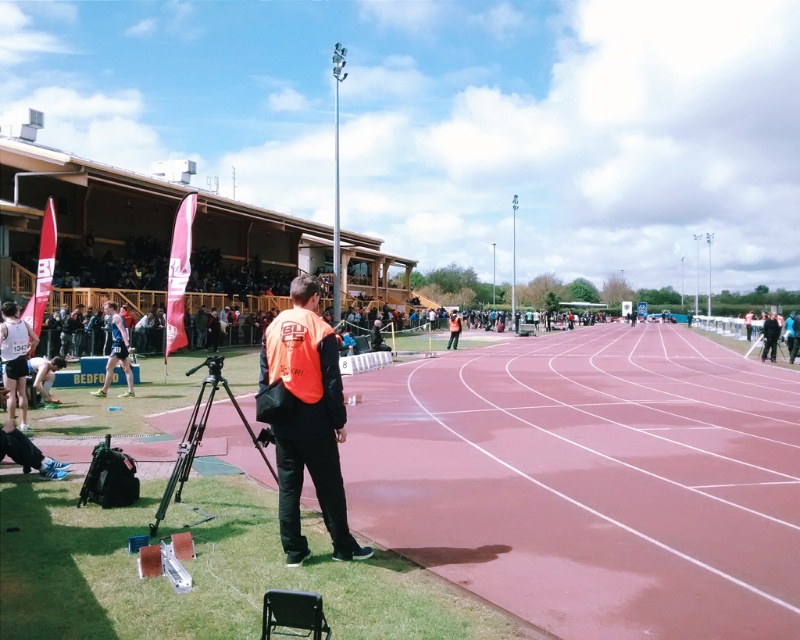
You are a photographer at the event and need to capture a closeup shot of the white athletic shorts at left and the black athletic suit at left. Which one will appear larger in your photo?

The white athletic shorts at left will appear larger in the photo since it is bigger than the black athletic suit at left.

You are a photographer at the event. You need to move from your current position near the orange fabric jacket at center to the black matte tripod at lower left to adjust its settings. Which direction should you move relative to the tripod?

The orange fabric jacket at center is positioned on the right side of the black matte tripod at lower left. Therefore, you should move to the left to reach the black matte tripod at lower left from the orange fabric jacket at center.